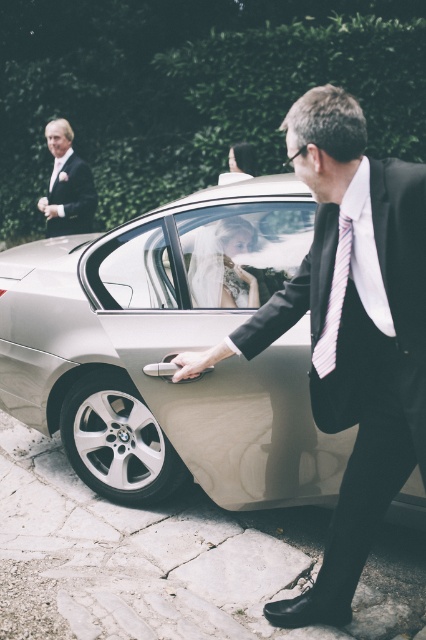
Can you confirm if matte black suit at center is shorter than matte black suit at upper left?

Incorrect, matte black suit at center's height does not fall short of matte black suit at upper left's.

Who is lower down, matte black suit at center or matte black suit at upper left?

matte black suit at center

Does point (371, 289) come in front of point (94, 204)?

Yes, point (371, 289) is in front of point (94, 204).

Find the location of `matte black suit at center`. matte black suit at center is located at coordinates (351, 330).

In the scene shown: Is silver metallic car at center smaller than matte black suit at upper left?

Actually, silver metallic car at center might be larger than matte black suit at upper left.

Describe the element at coordinates (170, 349) in the screenshot. Image resolution: width=426 pixels, height=640 pixels. I see `silver metallic car at center` at that location.

The height and width of the screenshot is (640, 426). Identify the location of silver metallic car at center. (170, 349).

This screenshot has width=426, height=640. What are the coordinates of `silver metallic car at center` in the screenshot? It's located at (170, 349).

Looking at this image, does matte black suit at center appear over white striped tie at right?

Actually, matte black suit at center is below white striped tie at right.

Which is behind, point (363, 532) or point (328, 342)?

The point (363, 532) is behind.

Does point (399, 252) come behind point (336, 337)?

No, (399, 252) is in front of (336, 337).

Image resolution: width=426 pixels, height=640 pixels. What are the coordinates of `matte black suit at center` in the screenshot? It's located at (351, 330).